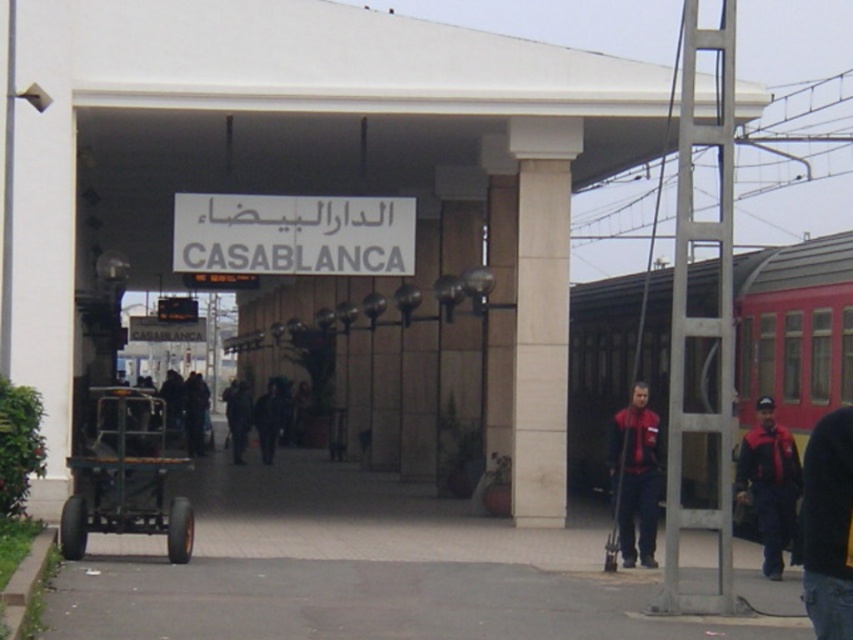
Is red fabric jacket at center positioned before dark clothing at center?

That is True.

Which is more to the left, red fabric jacket at center or dark clothing at center?

Positioned to the left is dark clothing at center.

Does point (643, 394) lie behind point (248, 408)?

No, (643, 394) is in front of (248, 408).

In order to click on red fabric jacket at center in this screenshot , I will do `click(635, 476)`.

Can you confirm if red jacket at right is positioned below dark clothing at center?

No.

Does red jacket at right appear over dark clothing at center?

Correct, red jacket at right is located above dark clothing at center.

Measure the distance between point (x=763, y=472) and camera.

Point (x=763, y=472) is 46.29 feet away from camera.

What are the coordinates of `red jacket at right` in the screenshot? It's located at (769, 483).

Is point (74, 490) closer to viewer compared to point (740, 452)?

No, (74, 490) is further to viewer.

Which is more to the left, metallic black cart at left or red jacket at right?

metallic black cart at left is more to the left.

What are the coordinates of `metallic black cart at left` in the screenshot? It's located at (126, 477).

Identify the location of metallic black cart at left. The height and width of the screenshot is (640, 853). (126, 477).